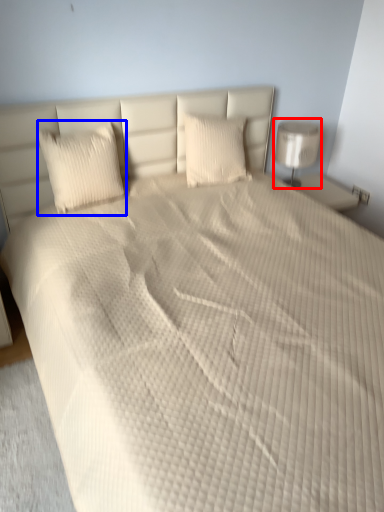
Question: Which point is closer to the camera, lamp (highlighted by a red box) or pillow (highlighted by a blue box)?

Choices:
 (A) lamp
 (B) pillow

Answer: (B)